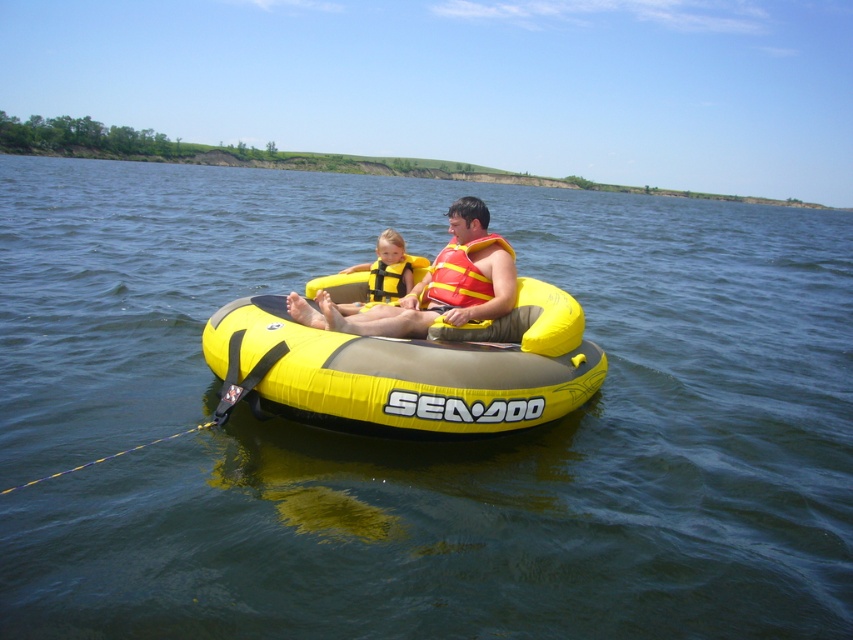
Measure the distance between yellow/inflatable boat at center and camera.

yellow/inflatable boat at center is 5.32 meters from camera.

Is point (582, 340) behind point (468, 208)?

No.

What do you see at coordinates (408, 371) in the screenshot? The image size is (853, 640). I see `yellow/inflatable boat at center` at bounding box center [408, 371].

I want to click on yellow/inflatable boat at center, so click(408, 371).

Can you confirm if yellow life vest at center is smaller than yellow fabric life jacket at center?

Actually, yellow life vest at center might be larger than yellow fabric life jacket at center.

Is yellow life vest at center taller than yellow fabric life jacket at center?

Correct, yellow life vest at center is much taller as yellow fabric life jacket at center.

Where is `yellow life vest at center`? The height and width of the screenshot is (640, 853). yellow life vest at center is located at coordinates (384, 273).

Does orange life vest at center lie in front of yellow fabric life jacket at center?

That is True.

Which is behind, point (479, 257) or point (379, 269)?

The point (379, 269) is behind.

Find the location of a particular element. orange life vest at center is located at coordinates (440, 291).